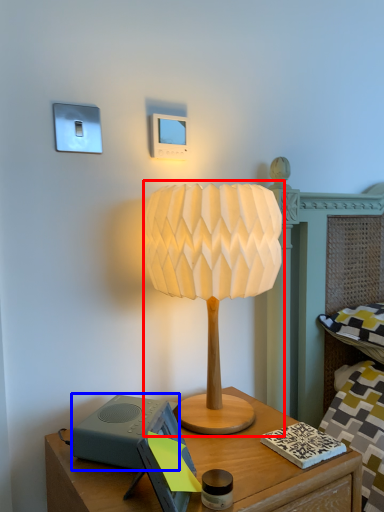
Question: Which object appears closest to the camera in this image, lamp (highlighted by a red box) or speaker (highlighted by a blue box)?

Choices:
 (A) lamp
 (B) speaker

Answer: (A)